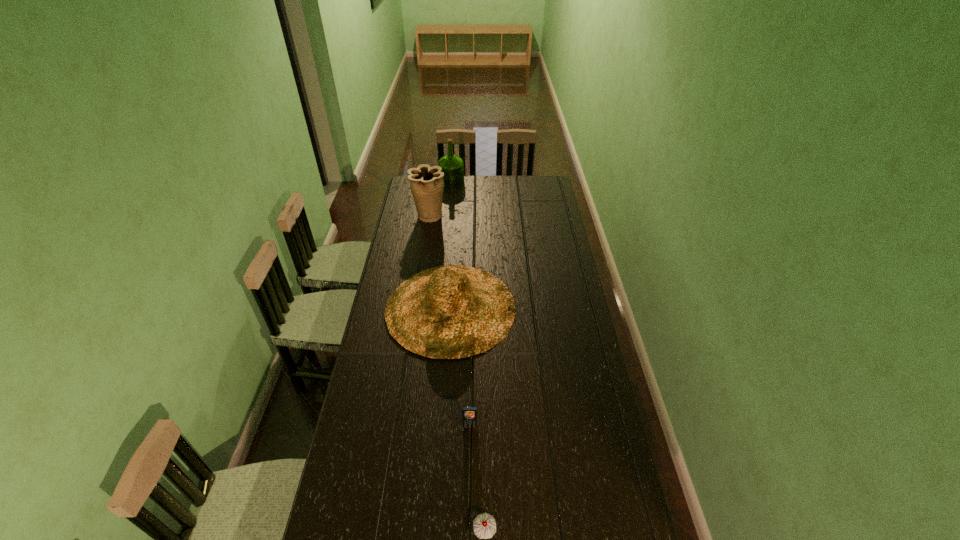
Where is `olive oil`? Image resolution: width=960 pixels, height=540 pixels. olive oil is located at coordinates (452, 166).

Find the location of a particular element. urn is located at coordinates (426, 183).

This screenshot has height=540, width=960. Find the location of `the third shortest object`. the third shortest object is located at coordinates (451, 311).

The image size is (960, 540). Identify the location of sunhat. (451, 311).

The image size is (960, 540). In order to click on the fourth farthest object in this screenshot , I will do (x=469, y=414).

I want to click on vacant space located on the front of the olive oil, so click(x=450, y=198).

What are the coordinates of `free space located on the back of the fourth nearest object` in the screenshot? It's located at (431, 201).

At what (x,y) coordinates should I click in order to perform the action: click on free space located on the front of the third tallest object. Please return your answer as a coordinate pair (x, y). Looking at the image, I should click on (445, 382).

Locate an element on the screen. vacant space located on the screen of the cellular telephone is located at coordinates (468, 504).

The image size is (960, 540). Identify the location of object that is at the far edge. (452, 166).